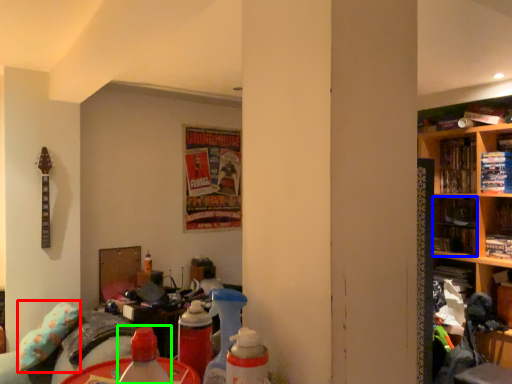
Question: Based on their relative distances, which object is nearer to pillow (highlighted by a red box)? Choose from book (highlighted by a blue box) and bottle (highlighted by a green box).

Choices:
 (A) book
 (B) bottle

Answer: (B)